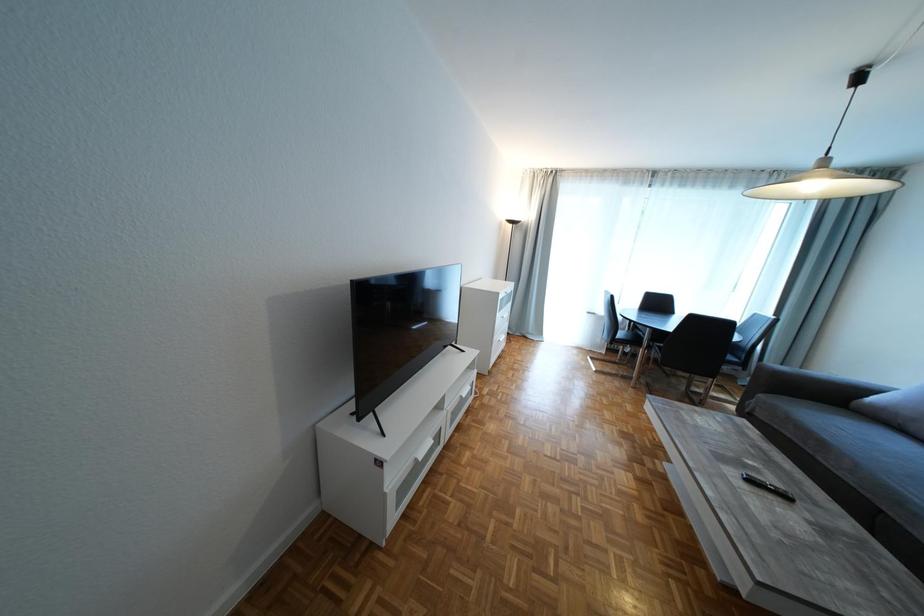
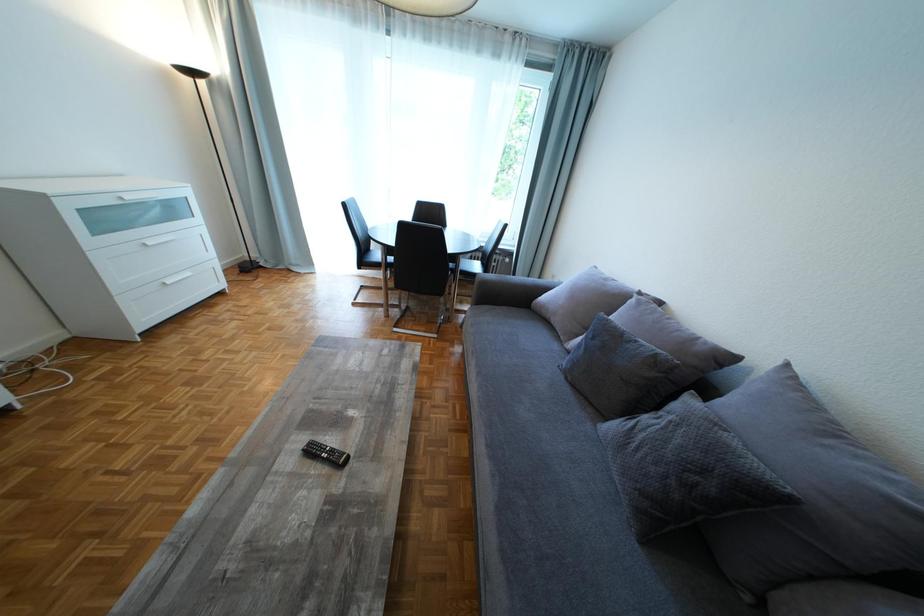
Question: What movement of the cameraman would produce the second image?

Choices:
 (A) Left
 (B) Right
 (C) Forward
 (D) Backward

Answer: (B)